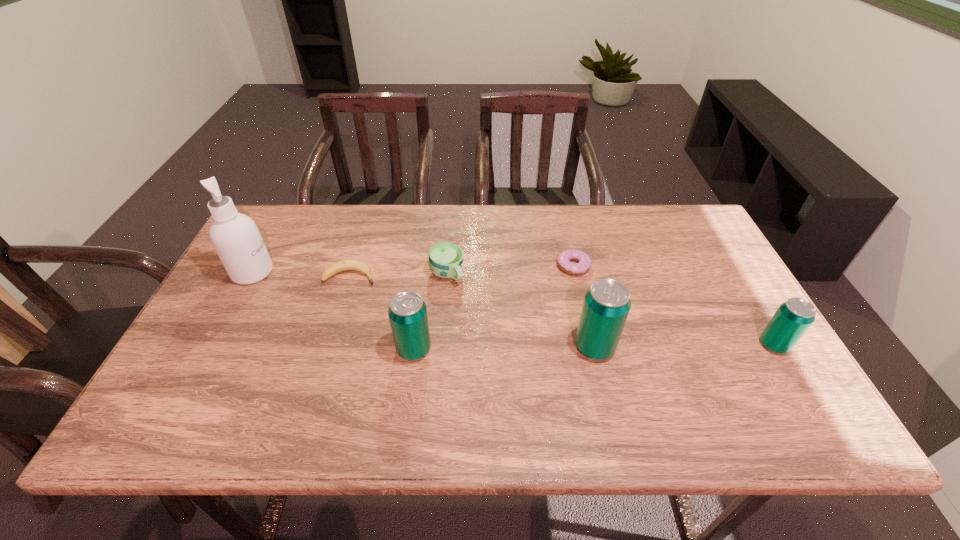
You are a GUI agent. You are given a task and a screenshot of the screen. Output one action in this format:
    pyautogui.click(x=<x>, y=<y>)
    Task: Click on the unoccupied position between the cup and the third tallest object
    This screenshot has width=960, height=540.
    Given the screenshot: What is the action you would take?
    pyautogui.click(x=430, y=312)

Locate an element on the screen. The height and width of the screenshot is (540, 960). the fourth closest object to the doughnut is located at coordinates click(792, 319).

Identify which object is located as the sixth nearest to the fifth tallest object. Please provide its 2D coordinates. Your answer should be formatted as a tuple, i.e. [(x, y)], where the tuple contains the x and y coordinates of a point satisfying the conditions above.

[(792, 319)]

Identify the location of beer can that is the third closest to the cup. This screenshot has height=540, width=960. (792, 319).

Select which beer can is the second closest to the second beer can from left to right. Please provide its 2D coordinates. Your answer should be formatted as a tuple, i.e. [(x, y)], where the tuple contains the x and y coordinates of a point satisfying the conditions above.

[(792, 319)]

At what (x,y) coordinates should I click in order to perform the action: click on vacant position in the image that satisfies the following two spatial constraints: 1. at the stem of the second beer can from left to right; 2. on the right side of the sixth object from right to left. Please return your answer as a coordinate pair (x, y). Looking at the image, I should click on (328, 347).

Find the location of a particular element. This screenshot has width=960, height=540. free space in the image that satisfies the following two spatial constraints: 1. on the front label of the cleansing agent; 2. on the back side of the cup is located at coordinates (252, 274).

Identify the location of free space that satisfies the following two spatial constraints: 1. on the back side of the leftmost beer can; 2. at the stem of the banana. This screenshot has height=540, width=960. (423, 275).